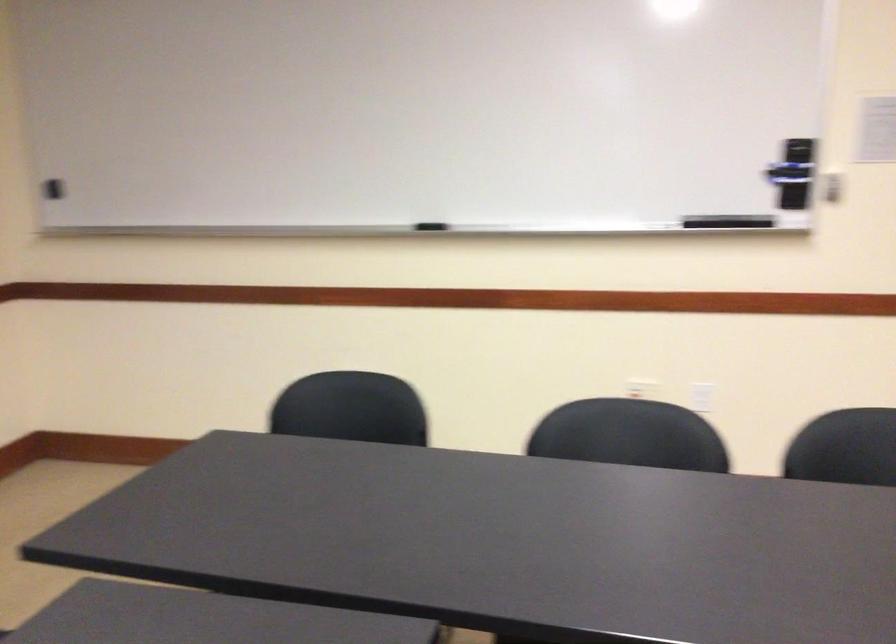
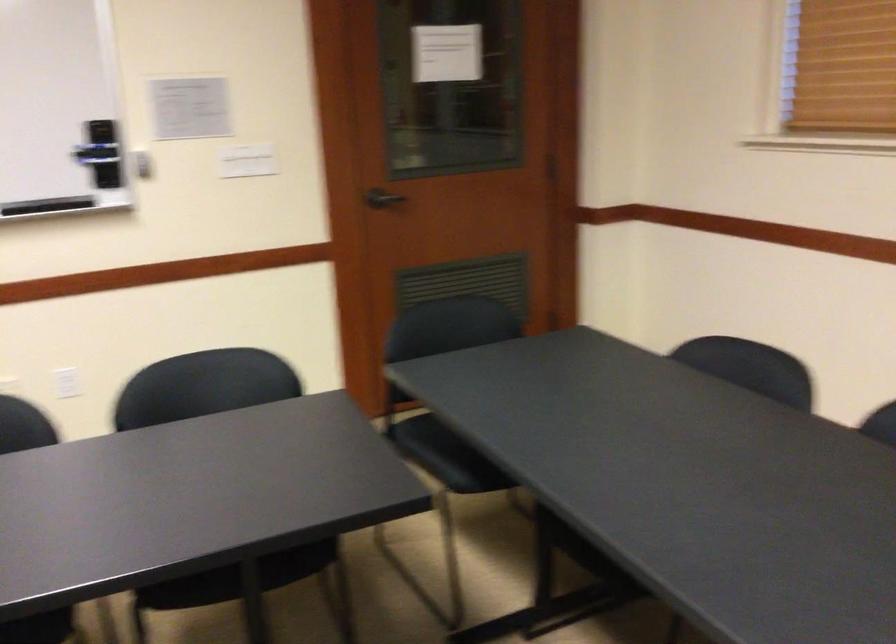
Where in the second image is the point corresponding to the point at 782,178 from the first image?

(100, 153)